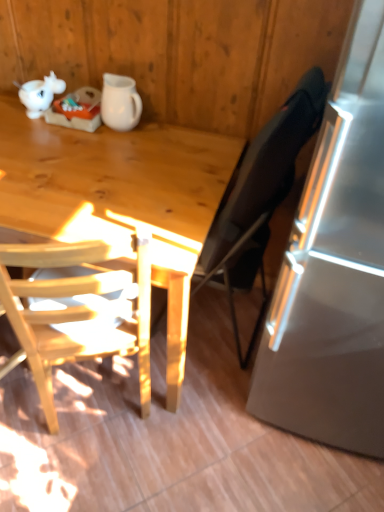
Question: Does light wood chair at left, arranged as the 2th chair when viewed from the right, have a lesser width compared to black fabric chair at right, which is counted as the first chair, starting from the right?

Choices:
 (A) no
 (B) yes

Answer: (A)

Question: Can you confirm if light wood chair at left, positioned as the 1th chair in left-to-right order, is shorter than black fabric chair at right, the 2th chair viewed from the left?

Choices:
 (A) no
 (B) yes

Answer: (A)

Question: Does light wood chair at left, positioned as the 1th chair in left-to-right order, have a larger size compared to black fabric chair at right, the 2th chair viewed from the left?

Choices:
 (A) yes
 (B) no

Answer: (A)

Question: Would you say light wood chair at left, arranged as the 2th chair when viewed from the right, is outside black fabric chair at right, the 2th chair viewed from the left?

Choices:
 (A) no
 (B) yes

Answer: (B)

Question: Considering the relative positions of light wood chair at left, positioned as the 1th chair in left-to-right order, and black fabric chair at right, which is counted as the first chair, starting from the right, in the image provided, is light wood chair at left, positioned as the 1th chair in left-to-right order, to the left of black fabric chair at right, which is counted as the first chair, starting from the right, from the viewer's perspective?

Choices:
 (A) yes
 (B) no

Answer: (A)

Question: From the image's perspective, relative to black fabric chair at right, which is counted as the first chair, starting from the right, is light wood chair at left, positioned as the 1th chair in left-to-right order, above or below?

Choices:
 (A) below
 (B) above

Answer: (A)

Question: Is light wood chair at left, positioned as the 1th chair in left-to-right order, inside the boundaries of black fabric chair at right, the 2th chair viewed from the left, or outside?

Choices:
 (A) inside
 (B) outside

Answer: (B)

Question: Is light wood chair at left, arranged as the 2th chair when viewed from the right, in front of or behind black fabric chair at right, which is counted as the first chair, starting from the right, in the image?

Choices:
 (A) front
 (B) behind

Answer: (A)

Question: Considering the relative positions of light wood chair at left, positioned as the 1th chair in left-to-right order, and black fabric chair at right, the 2th chair viewed from the left, in the image provided, is light wood chair at left, positioned as the 1th chair in left-to-right order, to the left or to the right of black fabric chair at right, the 2th chair viewed from the left,?

Choices:
 (A) left
 (B) right

Answer: (A)

Question: Considering their positions, is black fabric chair at right, which is counted as the first chair, starting from the right, located in front of or behind white matte pitcher at upper center?

Choices:
 (A) front
 (B) behind

Answer: (A)

Question: Looking at their shapes, would you say black fabric chair at right, which is counted as the first chair, starting from the right, is wider or thinner than white matte pitcher at upper center?

Choices:
 (A) wide
 (B) thin

Answer: (A)

Question: Based on their positions, is black fabric chair at right, the 2th chair viewed from the left, located to the left or right of white matte pitcher at upper center?

Choices:
 (A) right
 (B) left

Answer: (A)

Question: From a real-world perspective, is black fabric chair at right, which is counted as the first chair, starting from the right, positioned above or below white matte pitcher at upper center?

Choices:
 (A) above
 (B) below

Answer: (B)

Question: Considering their positions, is black fabric chair at right, which is counted as the first chair, starting from the right, located in front of or behind light wood chair at left, arranged as the 2th chair when viewed from the right?

Choices:
 (A) behind
 (B) front

Answer: (A)

Question: Is black fabric chair at right, which is counted as the first chair, starting from the right, taller or shorter than light wood chair at left, arranged as the 2th chair when viewed from the right?

Choices:
 (A) tall
 (B) short

Answer: (B)